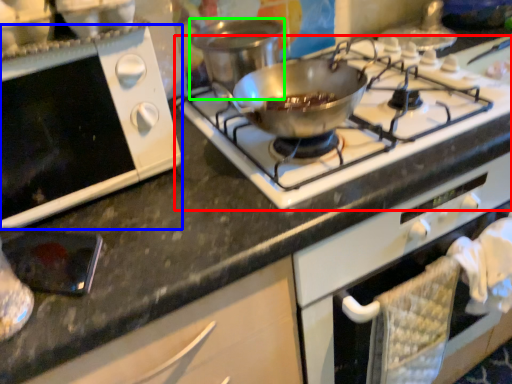
Question: Which is farther away from gas stove (highlighted by a red box)? oven (highlighted by a blue box) or pot/pan (highlighted by a green box)?

Choices:
 (A) oven
 (B) pot/pan

Answer: (A)